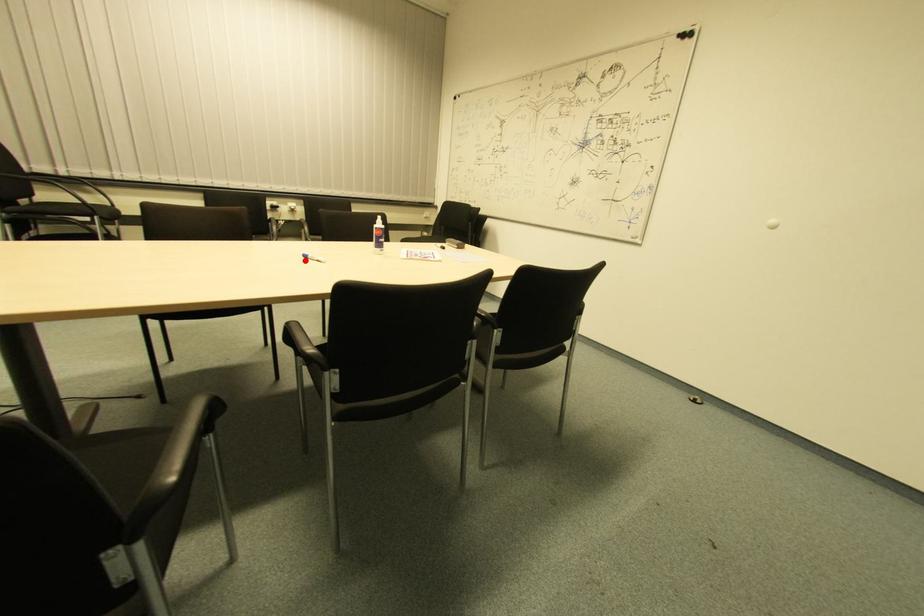
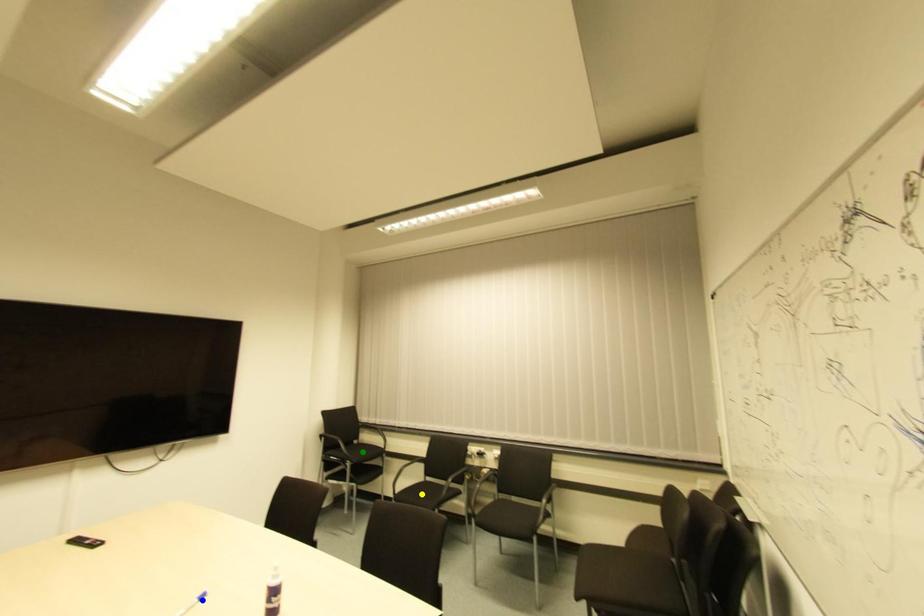
Question: I am providing you with two images of the same scene from different viewpoints. A red point is marked on the first image. You are given multiple points on the second image. Which spot in image 2 lines up with the point in image 1?

Choices:
 (A) green point
 (B) blue point
 (C) yellow point

Answer: (B)